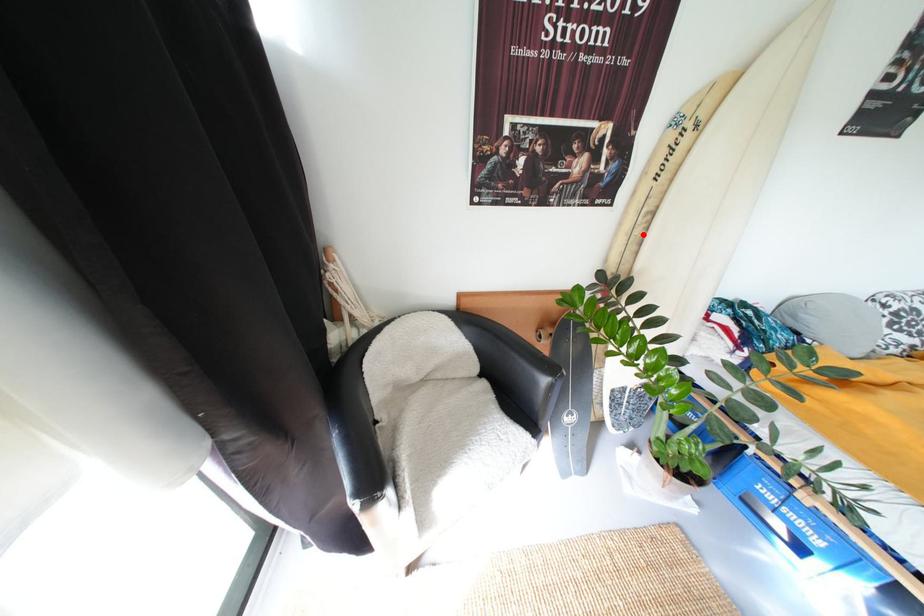
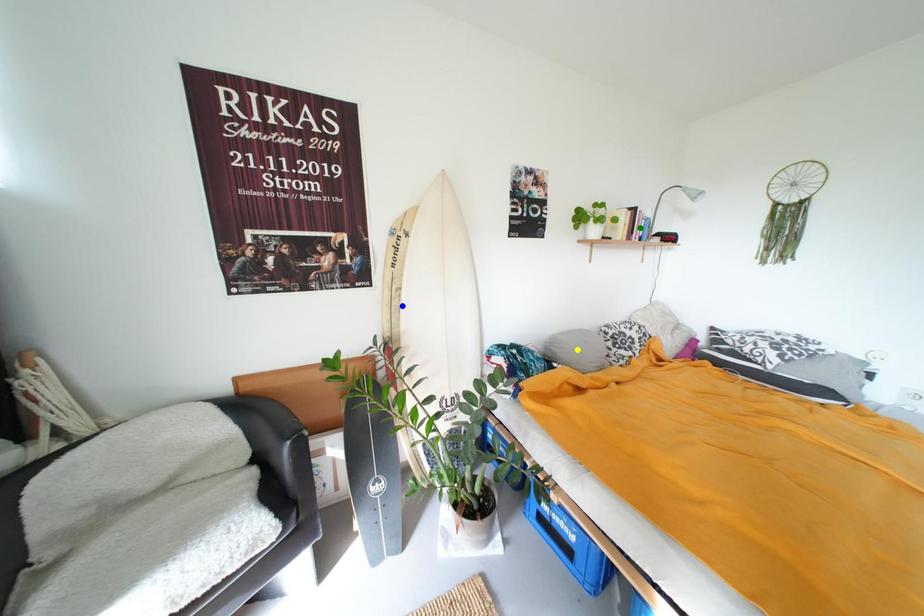
Question: I am providing you with two images of the same scene from different viewpoints. A red point is marked on the first image. You are given multiple points on the second image. In image 2, which mark is for the same physical point as the one in image 1?

Choices:
 (A) yellow point
 (B) blue point
 (C) green point

Answer: (B)